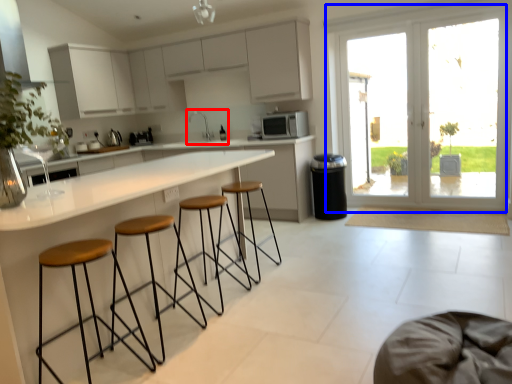
Question: Among these objects, which one is farthest to the camera, sink (highlighted by a red box) or door (highlighted by a blue box)?

Choices:
 (A) sink
 (B) door

Answer: (A)